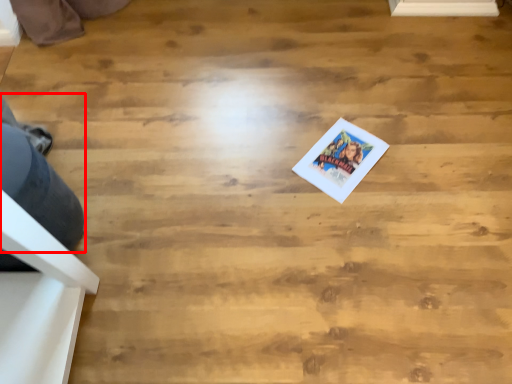
Question: From the image, what is the correct spatial relationship of person (annotated by the red box) in relation to postcard?

Choices:
 (A) left
 (B) right

Answer: (A)